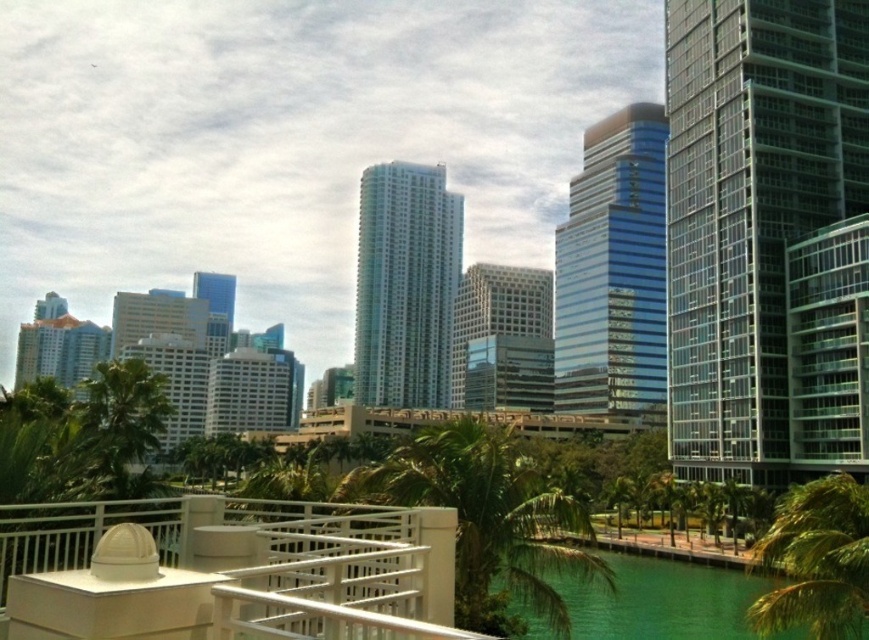
Question: Does green leafy palm tree at lower right lie in front of green leafy palm tree at lower left?

Choices:
 (A) no
 (B) yes

Answer: (B)

Question: Can you confirm if green leafy palm tree at center is smaller than green leafy palm tree at lower left?

Choices:
 (A) no
 (B) yes

Answer: (A)

Question: Does green leafy palm tree at center have a smaller size compared to green leafy palm tree at lower right?

Choices:
 (A) no
 (B) yes

Answer: (A)

Question: Which point is closer to the camera?

Choices:
 (A) green leafy palm tree at center
 (B) green leafy palm tree at lower left
 (C) green leafy palm tree at lower right

Answer: (A)

Question: Which point appears closest to the camera in this image?

Choices:
 (A) pyautogui.click(x=373, y=500)
 (B) pyautogui.click(x=866, y=492)
 (C) pyautogui.click(x=110, y=390)

Answer: (B)

Question: Among these points, which one is nearest to the camera?

Choices:
 (A) (485, 512)
 (B) (94, 429)

Answer: (A)